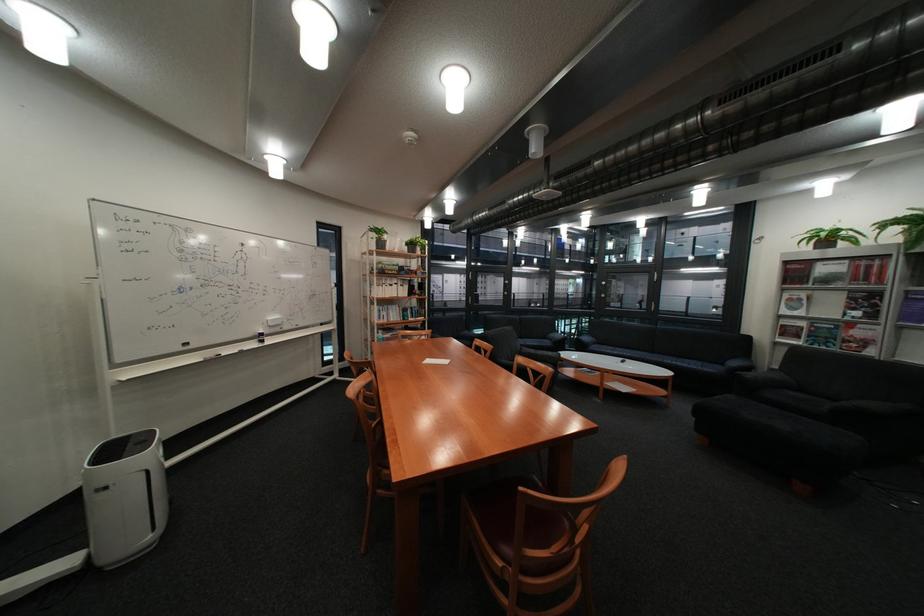
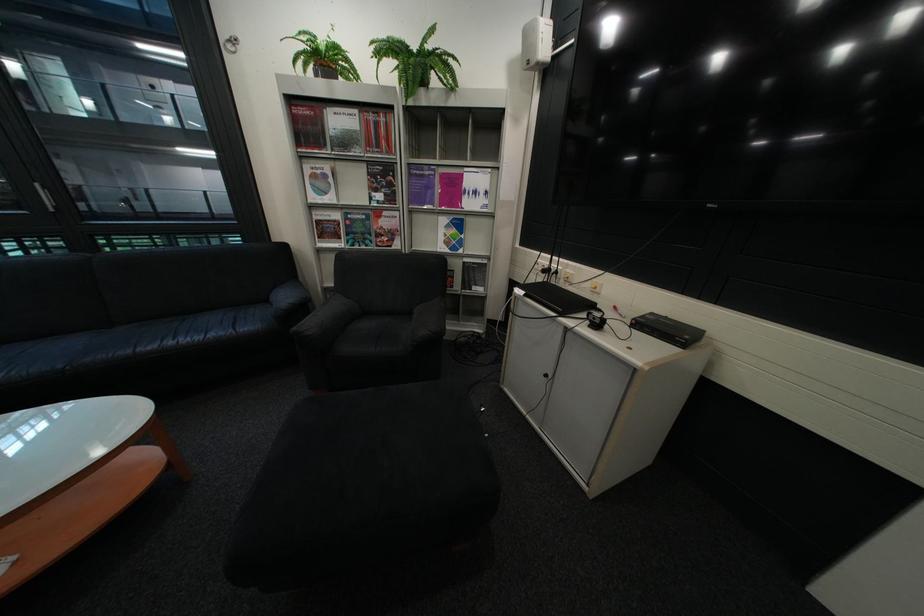
The point at (894, 312) is marked in the first image. Where is the corresponding point in the second image?

(409, 192)